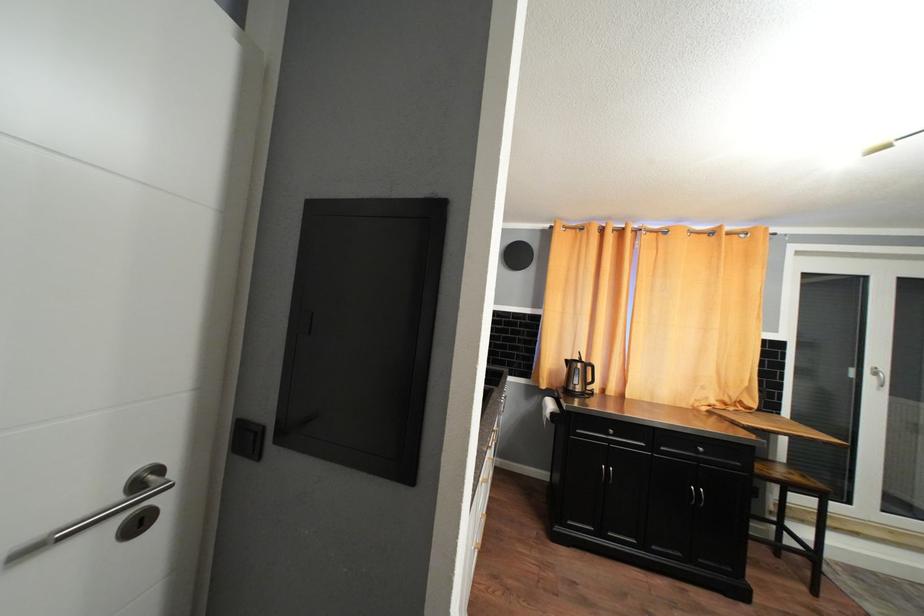
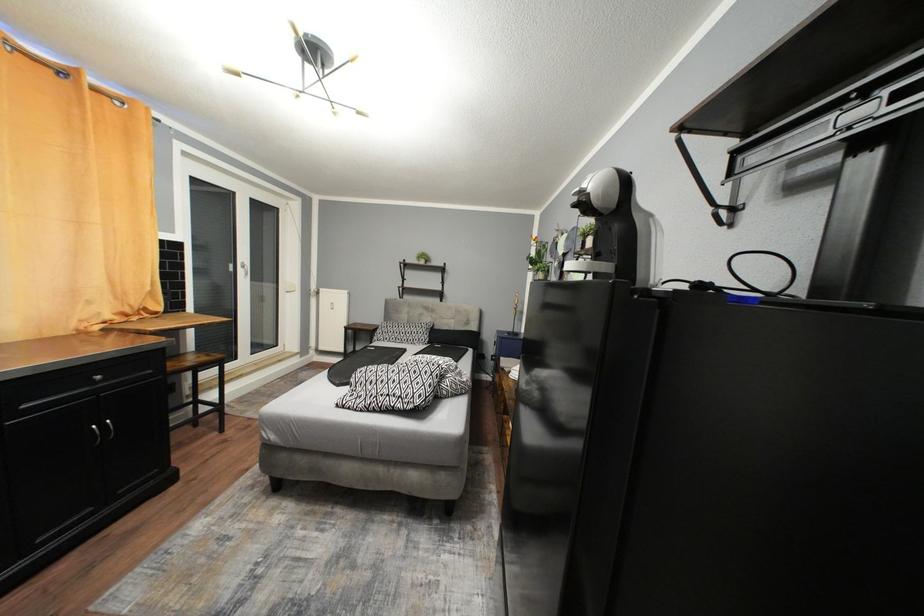
Question: The camera is either moving clockwise (left) or counter-clockwise (right) around the object. The first image is from the beginning of the video and the second image is from the end. Is the camera moving left or right when shooting the video?

Choices:
 (A) Left
 (B) Right

Answer: (A)